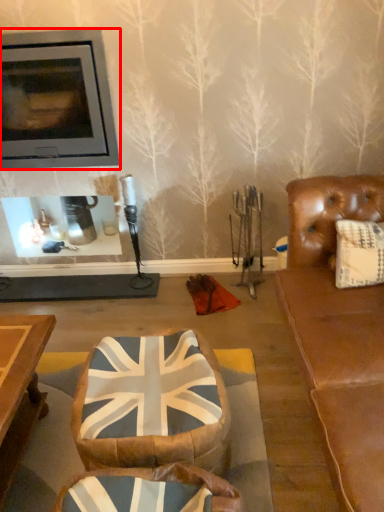
Question: From the image's perspective, what is the correct spatial relationship of fireplace (annotated by the red box) in relation to bean bag chair?

Choices:
 (A) above
 (B) below

Answer: (A)